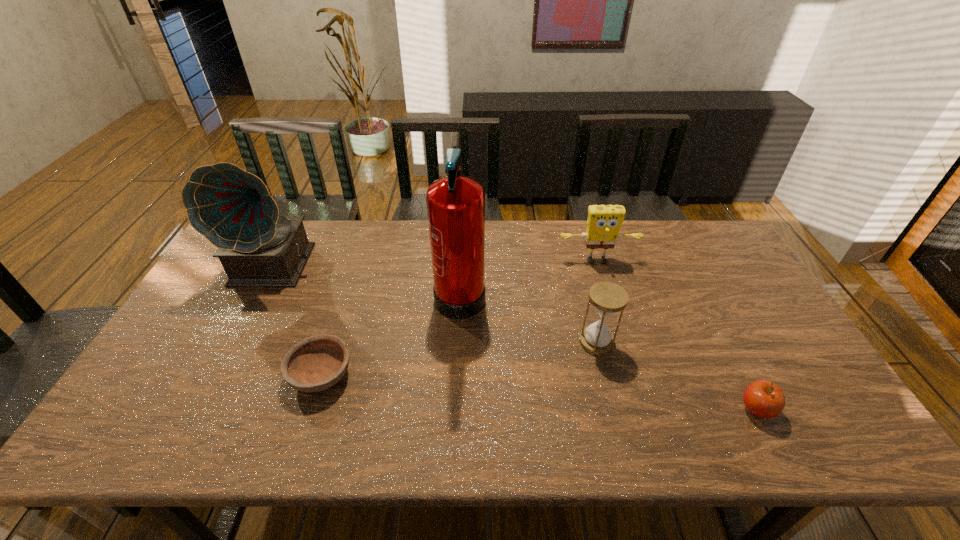
I want to click on object that is at the left edge, so click(x=233, y=209).

What are the coordinates of `object present at the right edge` in the screenshot? It's located at (764, 399).

Locate an element on the screen. object that is positioned at the far left corner is located at coordinates (233, 209).

The width and height of the screenshot is (960, 540). Identify the location of object positioned at the near right corner. coord(764,399).

In the image, there is a desktop. In order to click on vacant space at the far edge in this screenshot , I will do `click(319, 234)`.

The height and width of the screenshot is (540, 960). Find the location of `free point at the near edge`. free point at the near edge is located at coordinates (568, 415).

Locate an element on the screen. The image size is (960, 540). vacant point at the left edge is located at coordinates (226, 338).

The height and width of the screenshot is (540, 960). I want to click on vacant space at the near right corner of the desktop, so click(x=827, y=431).

Identify the location of free space between the fourth object from right to left and the leftmost object. (369, 278).

Where is `vacant space that's between the hourglass and the shortest object`? This screenshot has width=960, height=540. vacant space that's between the hourglass and the shortest object is located at coordinates (459, 359).